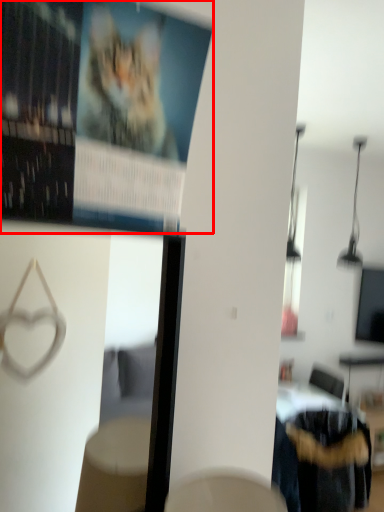
Question: From the image's perspective, considering the relative positions of poster page (annotated by the red box) and furniture in the image provided, where is poster page (annotated by the red box) located with respect to the staircase?

Choices:
 (A) below
 (B) above

Answer: (B)